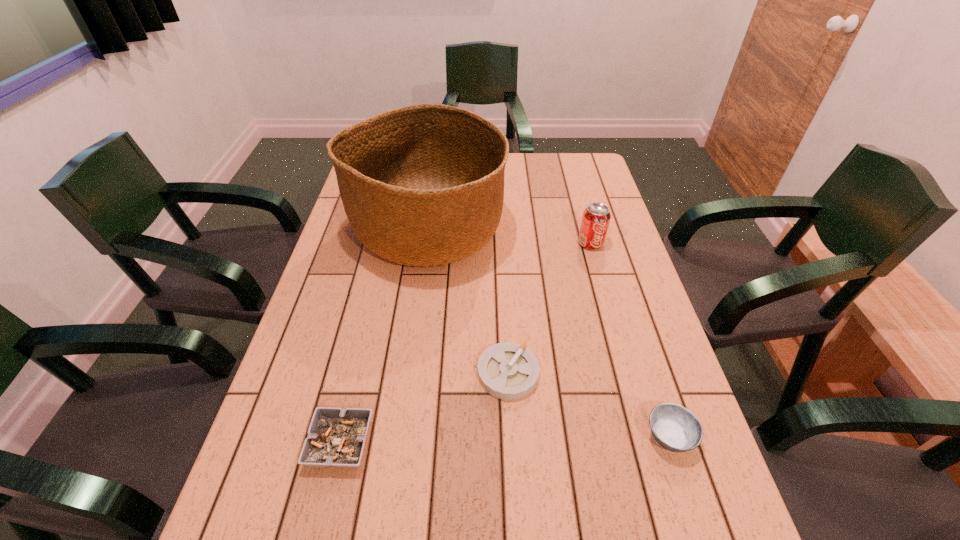
This screenshot has width=960, height=540. In order to click on object that is the fourth closest to the leftmost ashtray in this screenshot , I will do click(596, 217).

Locate which object ranks fourth in proximity to the farthest ashtray. Please provide its 2D coordinates. Your answer should be formatted as a tuple, i.e. [(x, y)], where the tuple contains the x and y coordinates of a point satisfying the conditions above.

[(596, 217)]

Locate an element on the screen. This screenshot has height=540, width=960. ashtray object that ranks as the second closest to the leftmost ashtray is located at coordinates (675, 428).

Choose which ashtray is the second nearest neighbor to the farthest ashtray. Please provide its 2D coordinates. Your answer should be formatted as a tuple, i.e. [(x, y)], where the tuple contains the x and y coordinates of a point satisfying the conditions above.

[(336, 437)]

Find the location of a particular element. This screenshot has height=540, width=960. vacant position in the image that satisfies the following two spatial constraints: 1. on the back side of the basket; 2. on the left side of the leftmost ashtray is located at coordinates (391, 230).

Locate an element on the screen. This screenshot has height=540, width=960. vacant point that satisfies the following two spatial constraints: 1. on the front side of the basket; 2. on the left side of the fourth shortest object is located at coordinates (426, 244).